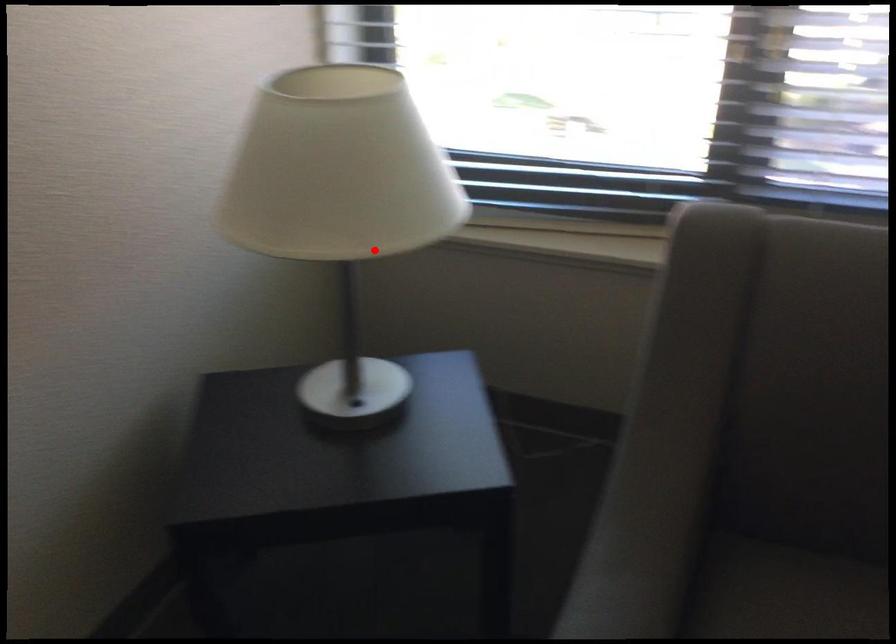
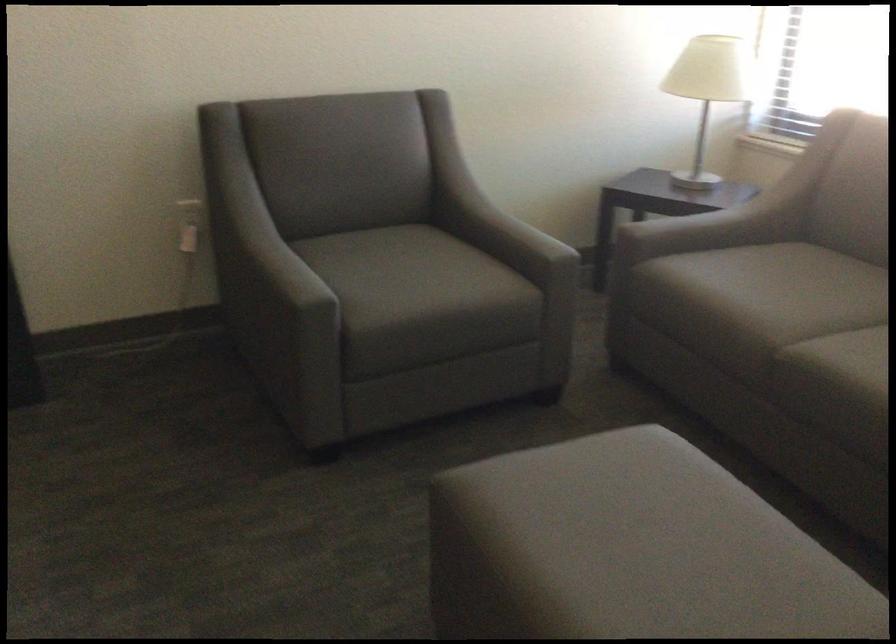
Where in the second image is the point corresponding to the highlighted location from the first image?

(708, 90)